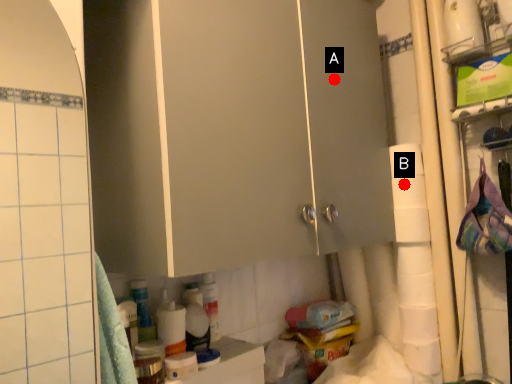
Question: Two points are circled on the image, labeled by A and B beside each circle. Which point is closer to the camera?

Choices:
 (A) A is closer
 (B) B is closer

Answer: (A)